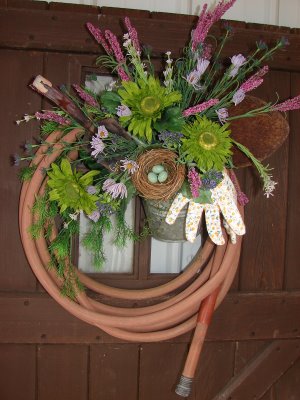
You are a GUI agent. You are given a task and a screenshot of the screen. Output one action in this format:
    pyautogui.click(x=<x>, y=<y>)
    Task: Click on the 1 left window
    
    Given the screenshot: What is the action you would take?
    pyautogui.click(x=122, y=260)